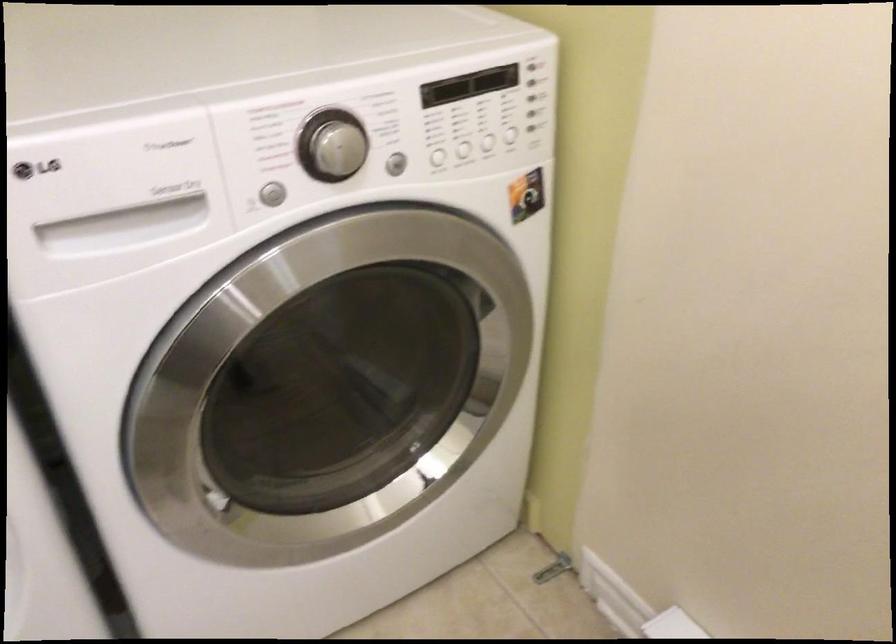
Locate an element on the screen. silver control dial is located at coordinates (332, 145).